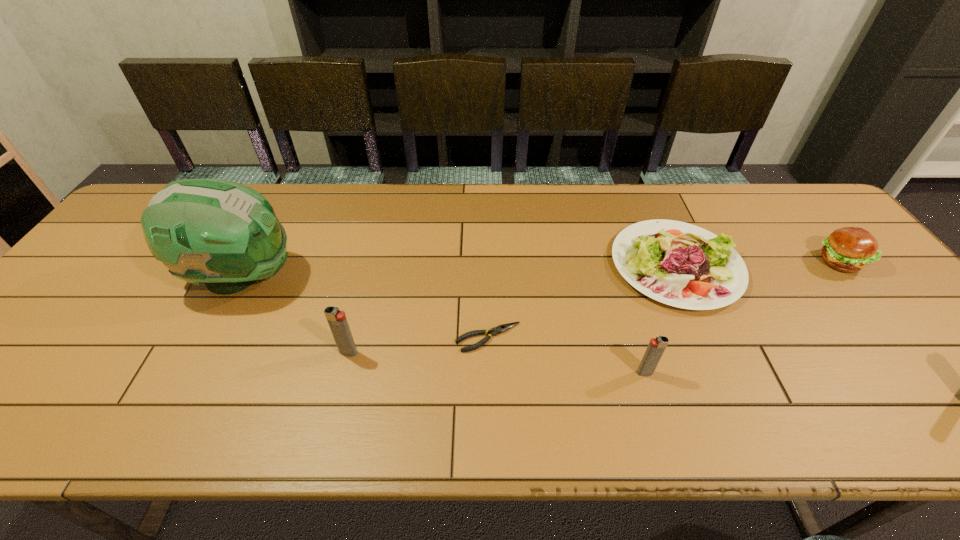
At what (x,y) coordinates should I click in order to perform the action: click on salad plate. Please return your answer as a coordinate pair (x, y). This screenshot has height=540, width=960. Looking at the image, I should click on (679, 264).

Locate an element on the screen. This screenshot has height=540, width=960. free space located 0.340m on the left of the second object from left to right is located at coordinates (190, 352).

Locate an element on the screen. The width and height of the screenshot is (960, 540). free location located 0.130m on the right of the shorter igniter is located at coordinates (712, 373).

The width and height of the screenshot is (960, 540). I want to click on free location located on the visor of the tallest object, so click(x=316, y=277).

The width and height of the screenshot is (960, 540). What are the coordinates of `vacant space located on the front of the third shortest object` in the screenshot? It's located at (889, 323).

The height and width of the screenshot is (540, 960). What are the coordinates of `vacant point located on the right of the fourth object from right to left` in the screenshot? It's located at (670, 338).

The image size is (960, 540). What are the coordinates of `free location located on the right of the salad plate` in the screenshot? It's located at (806, 266).

This screenshot has width=960, height=540. Identify the location of object present at the far edge. (679, 264).

This screenshot has width=960, height=540. In order to click on object located in the near edge section of the desktop in this screenshot , I will do `click(656, 347)`.

You are a GUI agent. You are given a task and a screenshot of the screen. Output one action in this format:
    pyautogui.click(x=<x>, y=<y>)
    Task: Click on the object at the right edge
    
    Given the screenshot: What is the action you would take?
    pyautogui.click(x=850, y=249)